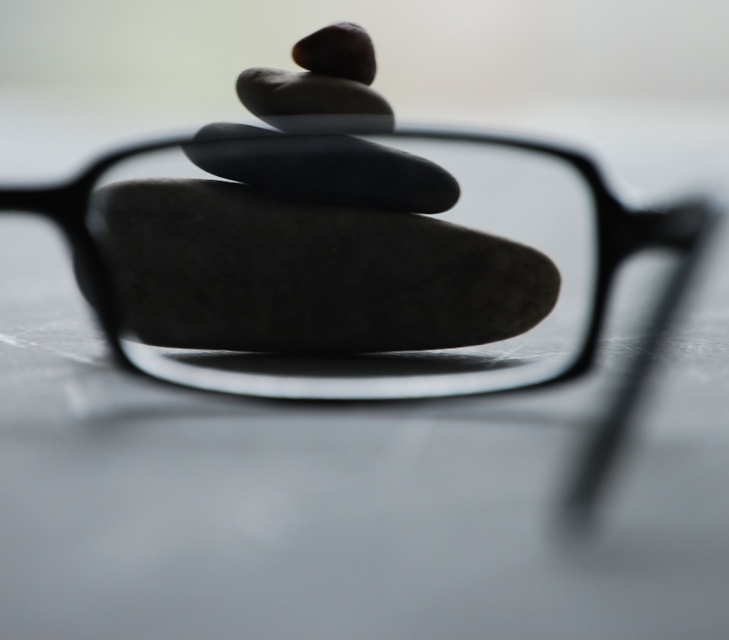
You are holding a camera and want to take a photo of the glasses. The camera has a focus range that can only focus on objects between 1 meter and 1.2 meters away. Is the point at coordinates point (658,337) within the camera focus range?

The point point (658,337) is 1.11 meters from the camera, which falls within the focus range of 1 meter to 1.2 meters. Therefore, the camera can focus on this point.